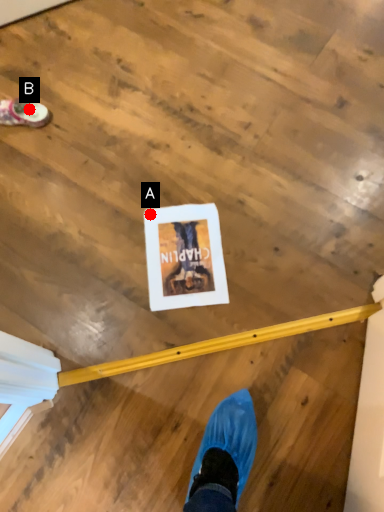
Question: Two points are circled on the image, labeled by A and B beside each circle. Which point is further to the camera?

Choices:
 (A) A is further
 (B) B is further

Answer: (B)